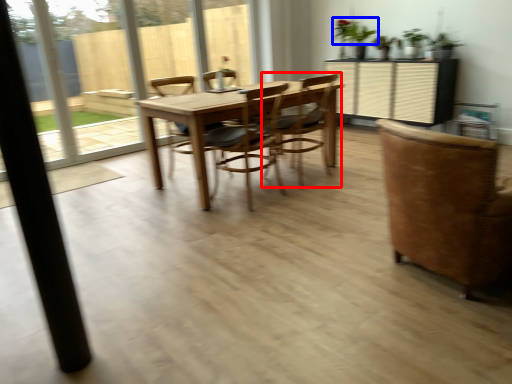
Question: Which object appears closest to the camera in this image, chair (highlighted by a red box) or plant (highlighted by a blue box)?

Choices:
 (A) chair
 (B) plant

Answer: (A)